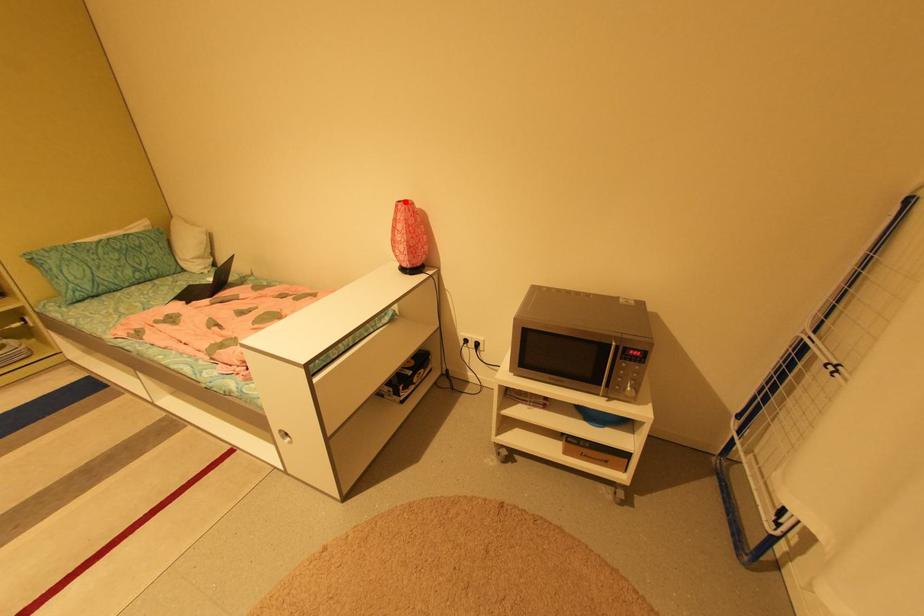
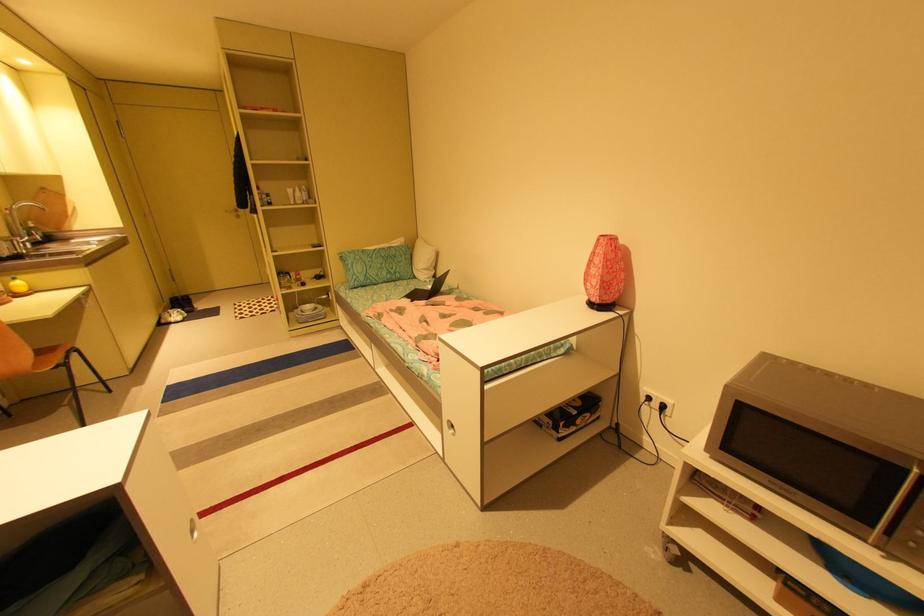
The point at the highlighted location is marked in the first image. Where is the corresponding point in the second image?

(608, 236)